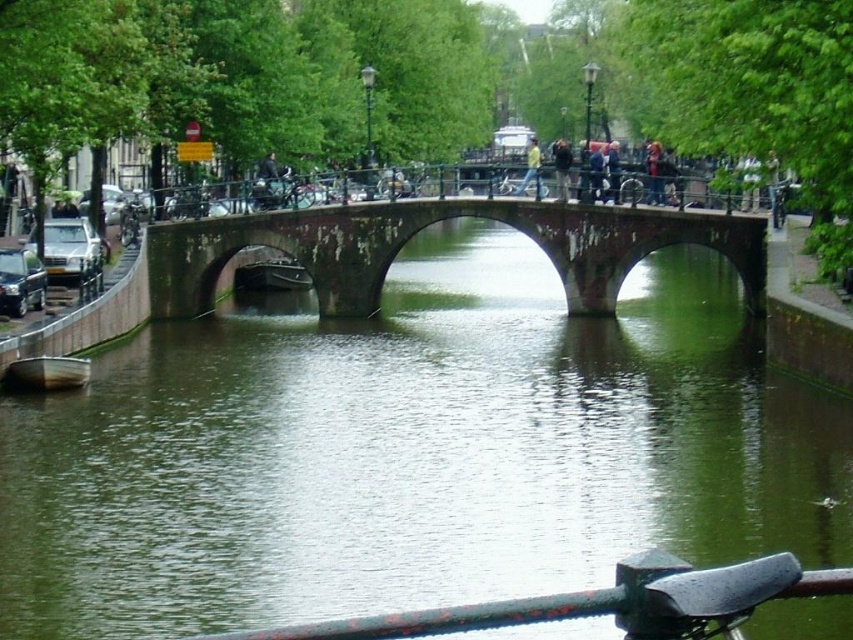
Does rusty stone bridge at center appear over rusty metal rail at lower center?

Indeed, rusty stone bridge at center is positioned over rusty metal rail at lower center.

Does rusty stone bridge at center have a greater height compared to rusty metal rail at lower center?

Yes, rusty stone bridge at center is taller than rusty metal rail at lower center.

Is point (488, 202) closer to viewer compared to point (743, 604)?

No, it is behind (743, 604).

The width and height of the screenshot is (853, 640). Identify the location of rusty stone bridge at center. (431, 224).

Measure the distance between green water at center and rusty stone bridge at center.

A distance of 8.60 meters exists between green water at center and rusty stone bridge at center.

Who is taller, green water at center or rusty stone bridge at center?

green water at center

Does point (218, 388) lie in front of point (190, 289)?

That is True.

Image resolution: width=853 pixels, height=640 pixels. Identify the location of green water at center. (413, 449).

Describe the element at coordinates (413, 449) in the screenshot. This screenshot has height=640, width=853. I see `green water at center` at that location.

Who is positioned more to the right, green water at center or rusty metal rail at lower center?

green water at center is more to the right.

Who is more distant from viewer, (569, 387) or (682, 637)?

Positioned behind is point (569, 387).

Locate an element on the screen. green water at center is located at coordinates (413, 449).